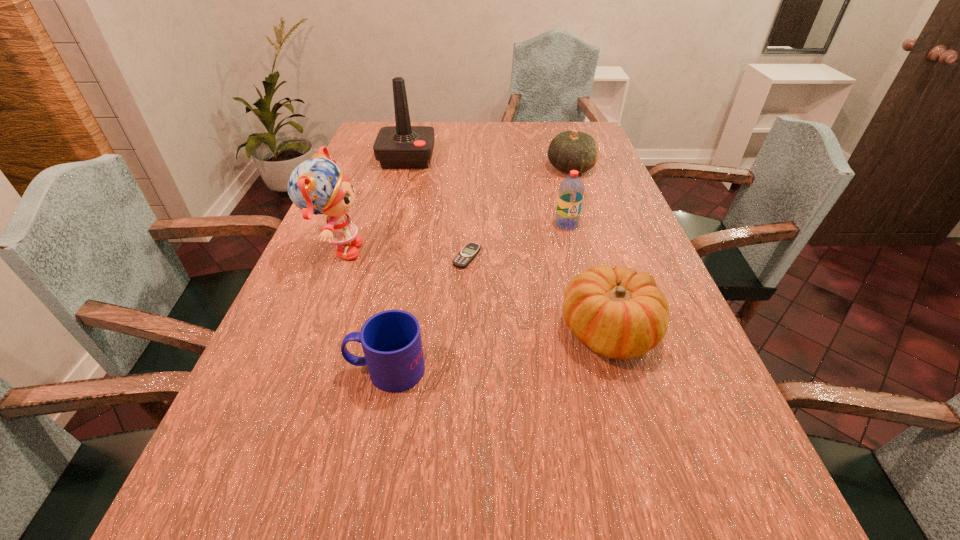
Identify the location of free location located 0.080m on the front label of the third tallest object. (573, 249).

Locate an element on the screen. vacant space situated on the left of the farther gourd is located at coordinates (490, 168).

Find the location of a particular element. This screenshot has height=540, width=960. free space located on the front of the nearer gourd is located at coordinates (638, 430).

I want to click on free space located 0.110m on the side with the handle of the mug, so click(x=291, y=370).

The width and height of the screenshot is (960, 540). Find the location of `vacant space located on the side with the handle of the mug`. vacant space located on the side with the handle of the mug is located at coordinates (281, 370).

You are a GUI agent. You are given a task and a screenshot of the screen. Output one action in this format:
    pyautogui.click(x=<x>, y=<y>)
    Task: Click on the vacant space situated on the side with the handle of the mug
    
    Given the screenshot: What is the action you would take?
    pyautogui.click(x=281, y=370)

At what (x,y) coordinates should I click in order to perform the action: click on vacant point located on the front of the beeper. Please return your answer as a coordinate pair (x, y). The image size is (960, 540). Looking at the image, I should click on (466, 314).

This screenshot has width=960, height=540. In order to click on object at the far edge in this screenshot , I will do `click(403, 146)`.

The image size is (960, 540). I want to click on joystick situated at the left edge, so click(403, 146).

Locate an element on the screen. The height and width of the screenshot is (540, 960). doll positioned at the left edge is located at coordinates (317, 186).